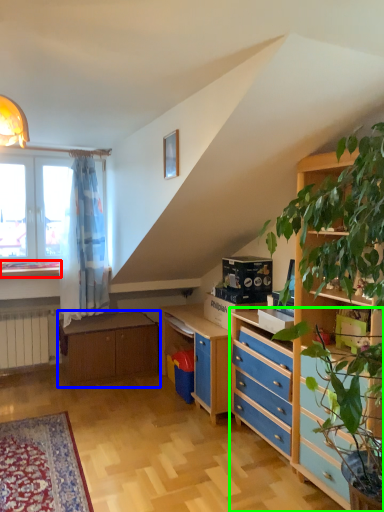
Question: Estimate the real-world distances between objects in this image. Which object is farther from window sill (highlighted by a red box), table (highlighted by a blue box) or chest of drawers (highlighted by a green box)?

Choices:
 (A) table
 (B) chest of drawers

Answer: (B)